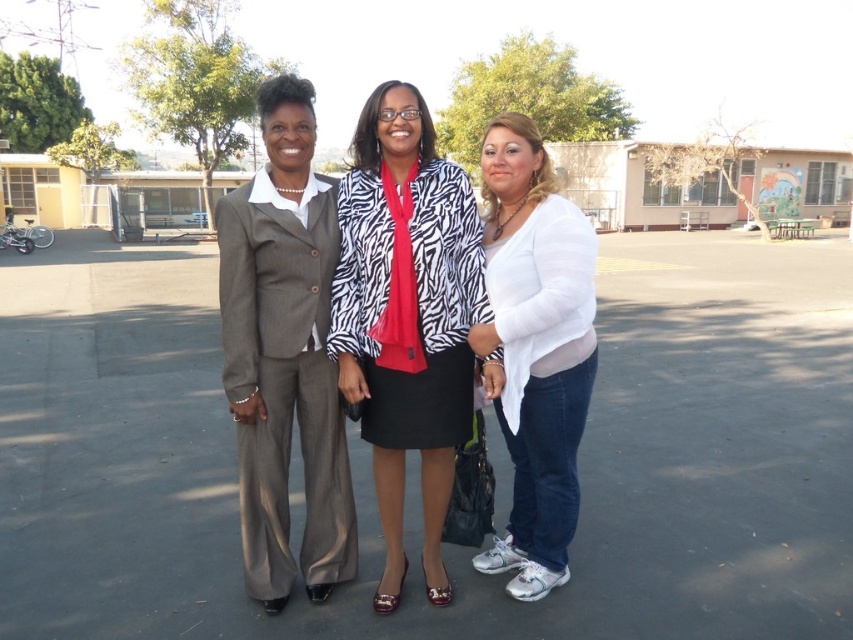
Question: Considering the relative positions of zebra print jacket at center and matte gray suit at left in the image provided, where is zebra print jacket at center located with respect to matte gray suit at left?

Choices:
 (A) below
 (B) above

Answer: (A)

Question: Does matte gray suit at left have a greater width compared to white matte shirt at center?

Choices:
 (A) yes
 (B) no

Answer: (A)

Question: Which point is closer to the camera?

Choices:
 (A) white matte shirt at center
 (B) black asphalt parking lot at center
 (C) zebra print jacket at center
 (D) matte gray suit at left

Answer: (A)

Question: Can you confirm if matte gray suit at left is positioned to the right of white matte shirt at center?

Choices:
 (A) yes
 (B) no

Answer: (B)

Question: Considering the real-world distances, which object is closest to the black asphalt parking lot at center?

Choices:
 (A) matte gray suit at left
 (B) white matte shirt at center

Answer: (B)

Question: Which point is closer to the camera?

Choices:
 (A) (312, 250)
 (B) (573, 516)
 (C) (447, 552)

Answer: (A)